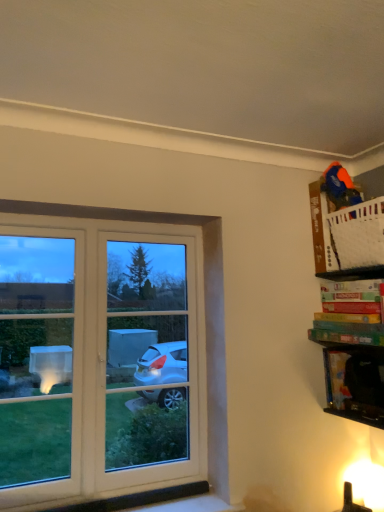
What is the approximate height of green matte board game at upper right, which is the first book in bottom-to-top order?

2.71 inches.

The width and height of the screenshot is (384, 512). What do you see at coordinates (350, 313) in the screenshot? I see `multicolored cardboard game at upper right, positioned as the second book in bottom-to-top order` at bounding box center [350, 313].

Locate an element on the screen. Image resolution: width=384 pixels, height=512 pixels. green matte board game at upper right, the second book from the top is located at coordinates (347, 337).

How different are the orientations of black plastic cabinet at lower right and green matte board game at upper right, the second book from the top, in degrees?

There is a 4.72-degree angle between the facing directions of black plastic cabinet at lower right and green matte board game at upper right, the second book from the top.

Consider the image. Looking at the image, does black plastic cabinet at lower right seem bigger or smaller compared to green matte board game at upper right, which is the first book in bottom-to-top order?

In the image, black plastic cabinet at lower right appears to be smaller than green matte board game at upper right, which is the first book in bottom-to-top order.

At what (x,y) coordinates should I click in order to perform the action: click on the 2nd book counting from the right of the black plastic cabinet at lower right. Please return your answer as a coordinate pair (x, y). Looking at the image, I should click on (347, 337).

At what (x,y) coordinates should I click in order to perform the action: click on book that is the 1st one when counting rightward from the black plastic cabinet at lower right. Please return your answer as a coordinate pair (x, y). The height and width of the screenshot is (512, 384). Looking at the image, I should click on (350, 313).

Considering the sizes of objects black plastic cabinet at lower right and multicolored cardboard game at upper right, placed as the first book when sorted from top to bottom, in the image provided, who is shorter, black plastic cabinet at lower right or multicolored cardboard game at upper right, placed as the first book when sorted from top to bottom,?

multicolored cardboard game at upper right, placed as the first book when sorted from top to bottom, is shorter.

Does black plastic cabinet at lower right have a greater width compared to multicolored cardboard game at upper right, placed as the first book when sorted from top to bottom?

No, black plastic cabinet at lower right is not wider than multicolored cardboard game at upper right, placed as the first book when sorted from top to bottom.

From a real-world perspective, which is physically below, black plastic cabinet at lower right or multicolored cardboard game at upper right, positioned as the second book in bottom-to-top order?

black plastic cabinet at lower right, from a real-world perspective.

Does multicolored cardboard game at upper right, placed as the first book when sorted from top to bottom, have a lesser width compared to black plastic cabinet at lower right?

No, multicolored cardboard game at upper right, placed as the first book when sorted from top to bottom, is not thinner than black plastic cabinet at lower right.

Where is `the 2nd book above the black plastic cabinet at lower right (from the image's perspective)`? the 2nd book above the black plastic cabinet at lower right (from the image's perspective) is located at coordinates (350, 313).

Considering their positions, is multicolored cardboard game at upper right, placed as the first book when sorted from top to bottom, located in front of or behind black plastic cabinet at lower right?

Visually, multicolored cardboard game at upper right, placed as the first book when sorted from top to bottom, is located in front of black plastic cabinet at lower right.

Is multicolored cardboard game at upper right, positioned as the second book in bottom-to-top order, to the left or to the right of black plastic cabinet at lower right in the image?

Based on their positions, multicolored cardboard game at upper right, positioned as the second book in bottom-to-top order, is located to the right of black plastic cabinet at lower right.

Can we say multicolored cardboard game at upper right, positioned as the second book in bottom-to-top order, lies outside green matte board game at upper right, the second book from the top?

Yes, multicolored cardboard game at upper right, positioned as the second book in bottom-to-top order, is outside of green matte board game at upper right, the second book from the top.

Considering the relative sizes of multicolored cardboard game at upper right, placed as the first book when sorted from top to bottom, and green matte board game at upper right, the second book from the top, in the image provided, is multicolored cardboard game at upper right, placed as the first book when sorted from top to bottom, wider than green matte board game at upper right, the second book from the top,?

In fact, multicolored cardboard game at upper right, placed as the first book when sorted from top to bottom, might be narrower than green matte board game at upper right, the second book from the top.

Does point (373, 335) appear closer or farther from the camera than point (314, 331)?

Point (373, 335).

From the image's perspective, which is above, multicolored cardboard game at upper right, positioned as the second book in bottom-to-top order, or green matte board game at upper right, the second book from the top?

multicolored cardboard game at upper right, positioned as the second book in bottom-to-top order.

Is green matte board game at upper right, the second book from the top, taller than black plastic cabinet at lower right?

Incorrect, the height of green matte board game at upper right, the second book from the top, is not larger of that of black plastic cabinet at lower right.

Which is less distant, [342,339] or [366,409]?

Point [342,339] appears to be closer to the viewer than point [366,409].

Is green matte board game at upper right, the second book from the top, wider or thinner than multicolored cardboard game at upper right, positioned as the second book in bottom-to-top order?

Clearly, green matte board game at upper right, the second book from the top, has more width compared to multicolored cardboard game at upper right, positioned as the second book in bottom-to-top order.

In the image, there is a green matte board game at upper right, which is the first book in bottom-to-top order. Where is `book above it (from the image's perspective)`? The width and height of the screenshot is (384, 512). book above it (from the image's perspective) is located at coordinates (350, 313).

Is green matte board game at upper right, which is the first book in bottom-to-top order, far from multicolored cardboard game at upper right, positioned as the second book in bottom-to-top order?

No, green matte board game at upper right, which is the first book in bottom-to-top order, is in close proximity to multicolored cardboard game at upper right, positioned as the second book in bottom-to-top order.

Identify the location of the 1st book located above the black plastic cabinet at lower right (from a real-world perspective). The image size is (384, 512). (347, 337).

Which book is the 1st one when counting from the front of the black plastic cabinet at lower right? Please provide its 2D coordinates.

[(350, 313)]

Estimate the real-world distances between objects in this image. Which object is further from green matte board game at upper right, which is the first book in bottom-to-top order, multicolored cardboard game at upper right, positioned as the second book in bottom-to-top order, or black plastic cabinet at lower right?

black plastic cabinet at lower right lies further to green matte board game at upper right, which is the first book in bottom-to-top order, than the other object.

Which object lies nearer to the anchor point multicolored cardboard game at upper right, positioned as the second book in bottom-to-top order, green matte board game at upper right, which is the first book in bottom-to-top order, or black plastic cabinet at lower right?

green matte board game at upper right, which is the first book in bottom-to-top order, lies closer to multicolored cardboard game at upper right, positioned as the second book in bottom-to-top order, than the other object.

From the image, which object appears to be farther from black plastic cabinet at lower right, green matte board game at upper right, the second book from the top, or multicolored cardboard game at upper right, placed as the first book when sorted from top to bottom?

Based on the image, multicolored cardboard game at upper right, placed as the first book when sorted from top to bottom, appears to be further to black plastic cabinet at lower right.

Considering their positions, is black plastic cabinet at lower right positioned further to green matte board game at upper right, which is the first book in bottom-to-top order, than multicolored cardboard game at upper right, placed as the first book when sorted from top to bottom?

Based on the image, black plastic cabinet at lower right appears to be further to green matte board game at upper right, which is the first book in bottom-to-top order.

Which object lies nearer to the anchor point black plastic cabinet at lower right, multicolored cardboard game at upper right, positioned as the second book in bottom-to-top order, or green matte board game at upper right, the second book from the top?

green matte board game at upper right, the second book from the top, lies closer to black plastic cabinet at lower right than the other object.

Which object lies further to the anchor point multicolored cardboard game at upper right, placed as the first book when sorted from top to bottom, black plastic cabinet at lower right or green matte board game at upper right, the second book from the top?

black plastic cabinet at lower right is positioned further to the anchor multicolored cardboard game at upper right, placed as the first book when sorted from top to bottom.

At what (x,y) coordinates should I click in order to perform the action: click on book between multicolored cardboard game at upper right, placed as the first book when sorted from top to bottom, and black plastic cabinet at lower right in the up-down direction. Please return your answer as a coordinate pair (x, y). This screenshot has height=512, width=384. Looking at the image, I should click on (347, 337).